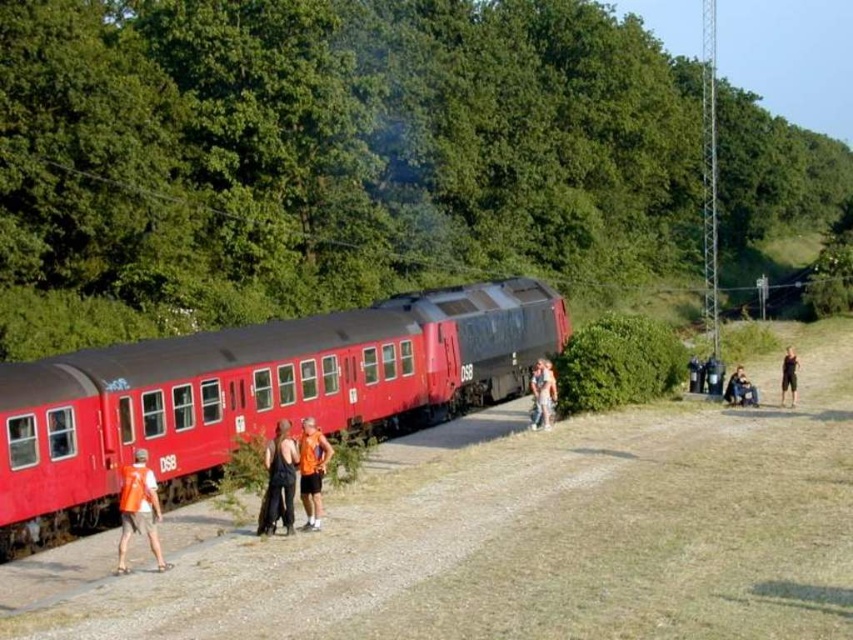
You are a passenger on the DSB train and need to locate the safety inspector. You see an orange reflective vest at lower left and an orange sleeveless shirt at center. Which one is closer to you?

The orange reflective vest at lower left is closer to you because it is in front of the orange sleeveless shirt at center.

You are a pedestrian standing at the edge of the railway and see the orange reflective vest at lower left and the orange fabric shorts at center. Which object is closer to your position?

The orange reflective vest at lower left is located below orange fabric shorts at center, so it is closer to your position.

You are a photographer standing near the train and see both the matte black tank top at center and the orange sleeveless shirt at center. Which clothing item is positioned lower in the image?

The matte black tank top at center is positioned lower in the image as it is below the orange sleeveless shirt at center.